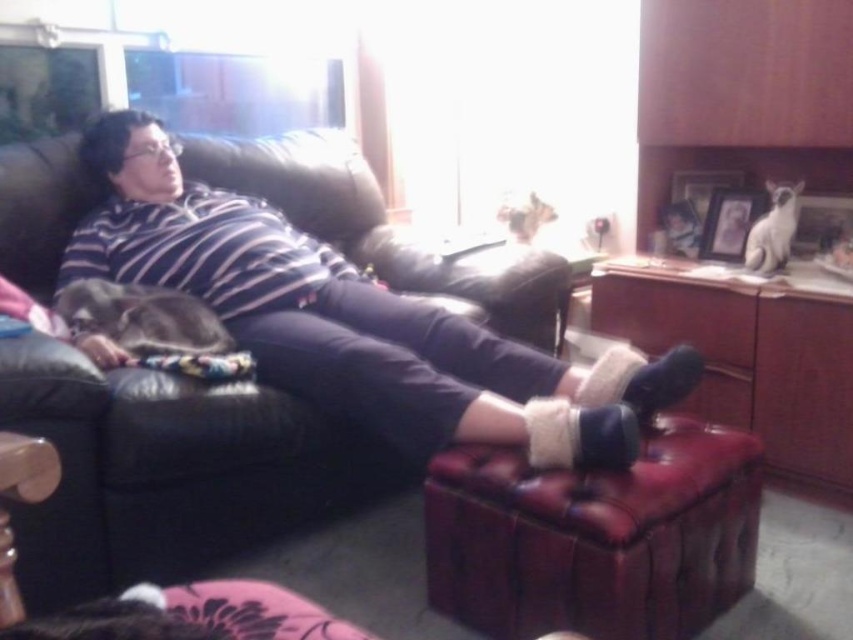
Question: Which point appears closest to the camera in this image?

Choices:
 (A) (643, 580)
 (B) (187, 561)

Answer: (A)

Question: Considering the relative positions of black leather couch at upper left and leather ottoman at lower center in the image provided, where is black leather couch at upper left located with respect to leather ottoman at lower center?

Choices:
 (A) right
 (B) left

Answer: (B)

Question: Where is black leather couch at upper left located in relation to leather ottoman at lower center in the image?

Choices:
 (A) left
 (B) right

Answer: (A)

Question: Which object appears farthest from the camera in this image?

Choices:
 (A) leather ottoman at lower center
 (B) black leather couch at upper left

Answer: (B)

Question: Does black leather couch at upper left appear under leather ottoman at lower center?

Choices:
 (A) no
 (B) yes

Answer: (A)